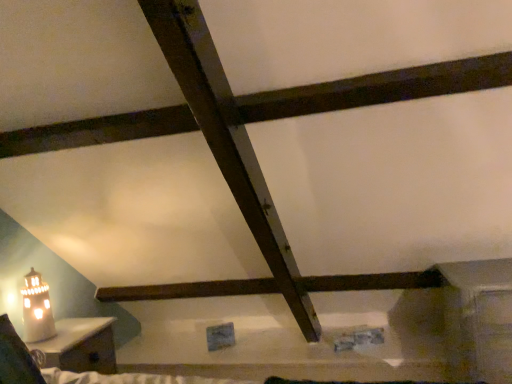
Where is `white ceramic table lamp at lower left`? white ceramic table lamp at lower left is located at coordinates (37, 309).

Describe the element at coordinates (37, 309) in the screenshot. I see `white ceramic table lamp at lower left` at that location.

The height and width of the screenshot is (384, 512). What do you see at coordinates (81, 345) in the screenshot? I see `matte wooden nightstand at lower left` at bounding box center [81, 345].

Measure the distance between point (x=113, y=361) and camera.

Point (x=113, y=361) and camera are 7.28 feet apart.

Where is `matte wooden nightstand at lower left`? This screenshot has height=384, width=512. matte wooden nightstand at lower left is located at coordinates (81, 345).

Identify the location of white ceramic table lamp at lower left. The height and width of the screenshot is (384, 512). (37, 309).

Is matte wooden nightstand at lower left at the right side of white ceramic table lamp at lower left?

Yes.

Is matte wooden nightstand at lower left behind white ceramic table lamp at lower left?

No, matte wooden nightstand at lower left is closer to the camera.

Is point (106, 328) closer to camera compared to point (23, 305)?

No.

From the image's perspective, does matte wooden nightstand at lower left appear lower than white ceramic table lamp at lower left?

Correct, matte wooden nightstand at lower left appears lower than white ceramic table lamp at lower left in the image.

From a real-world perspective, is matte wooden nightstand at lower left physically located above or below white ceramic table lamp at lower left?

In terms of real-world spatial position, matte wooden nightstand at lower left is below white ceramic table lamp at lower left.

Which object is thinner, matte wooden nightstand at lower left or white ceramic table lamp at lower left?

Thinner between the two is white ceramic table lamp at lower left.

Is matte wooden nightstand at lower left shorter than white ceramic table lamp at lower left?

Incorrect, the height of matte wooden nightstand at lower left does not fall short of that of white ceramic table lamp at lower left.

Based on the photo, does matte wooden nightstand at lower left have a larger size compared to white ceramic table lamp at lower left?

Correct, matte wooden nightstand at lower left is larger in size than white ceramic table lamp at lower left.

Is matte wooden nightstand at lower left located outside white ceramic table lamp at lower left?

Yes, matte wooden nightstand at lower left is not within white ceramic table lamp at lower left.

Would you consider matte wooden nightstand at lower left to be distant from white ceramic table lamp at lower left?

That's not correct — matte wooden nightstand at lower left is a little close to white ceramic table lamp at lower left.

Does matte wooden nightstand at lower left turn towards white ceramic table lamp at lower left?

No, matte wooden nightstand at lower left is not aimed at white ceramic table lamp at lower left.

What's the angular difference between matte wooden nightstand at lower left and white ceramic table lamp at lower left's facing directions?

3.81 degrees.

How much distance is there between matte wooden nightstand at lower left and white ceramic table lamp at lower left?

6.31 inches.

Find the location of a particular element. table lamp above the matte wooden nightstand at lower left (from the image's perspective) is located at coordinates (37, 309).

Visually, is white ceramic table lamp at lower left positioned to the left or to the right of matte wooden nightstand at lower left?

In the image, white ceramic table lamp at lower left appears on the left side of matte wooden nightstand at lower left.

Is white ceramic table lamp at lower left positioned before matte wooden nightstand at lower left?

No, it is behind matte wooden nightstand at lower left.

Which is less distant, (27, 322) or (81, 363)?

Clearly, point (27, 322) is closer to the camera than point (81, 363).

From the image's perspective, which object appears higher, white ceramic table lamp at lower left or matte wooden nightstand at lower left?

white ceramic table lamp at lower left appears higher in the image.

From a real-world perspective, between white ceramic table lamp at lower left and matte wooden nightstand at lower left, who is vertically higher?

white ceramic table lamp at lower left.

Which object is thinner, white ceramic table lamp at lower left or matte wooden nightstand at lower left?

white ceramic table lamp at lower left is thinner.

In terms of height, does white ceramic table lamp at lower left look taller or shorter compared to matte wooden nightstand at lower left?

In the image, white ceramic table lamp at lower left appears to be shorter than matte wooden nightstand at lower left.

Based on their sizes in the image, would you say white ceramic table lamp at lower left is bigger or smaller than matte wooden nightstand at lower left?

white ceramic table lamp at lower left is smaller than matte wooden nightstand at lower left.

Choose the correct answer: Is white ceramic table lamp at lower left inside matte wooden nightstand at lower left or outside it?

white ceramic table lamp at lower left is not enclosed by matte wooden nightstand at lower left.

Is white ceramic table lamp at lower left next to matte wooden nightstand at lower left and touching it?

There is a gap between white ceramic table lamp at lower left and matte wooden nightstand at lower left.

Is white ceramic table lamp at lower left looking in the opposite direction of matte wooden nightstand at lower left?

No, white ceramic table lamp at lower left is not facing away from matte wooden nightstand at lower left.

How much distance is there between white ceramic table lamp at lower left and matte wooden nightstand at lower left?

white ceramic table lamp at lower left and matte wooden nightstand at lower left are 6.31 inches apart.

Where is `table lamp lying above the matte wooden nightstand at lower left (from the image's perspective)`? Image resolution: width=512 pixels, height=384 pixels. table lamp lying above the matte wooden nightstand at lower left (from the image's perspective) is located at coordinates tap(37, 309).

The image size is (512, 384). In order to click on table lamp that is above the matte wooden nightstand at lower left (from the image's perspective) in this screenshot , I will do `click(37, 309)`.

Where is `furniture lying in front of the white ceramic table lamp at lower left`? Image resolution: width=512 pixels, height=384 pixels. furniture lying in front of the white ceramic table lamp at lower left is located at coordinates (81, 345).